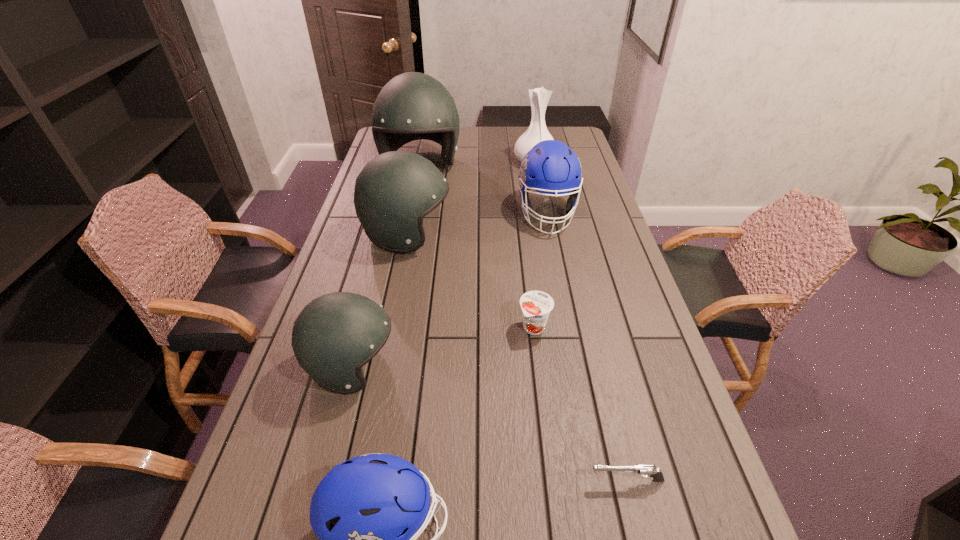
You are a GUI agent. You are given a task and a screenshot of the screen. Output one action in this format:
    pyautogui.click(x=<x>, y=<y>)
    Task: Click on the tallest object
    
    Given the screenshot: What is the action you would take?
    pyautogui.click(x=412, y=106)

Where is `the farthest football helmet`? the farthest football helmet is located at coordinates (412, 106).

Where is `white vase`? white vase is located at coordinates (539, 97).

Identify the location of the second nearest green football helmet. (394, 191).

Image resolution: width=960 pixels, height=540 pixels. I want to click on the right blue football helmet, so click(x=550, y=167).

Find the location of a particular element. This screenshot has width=960, height=540. the bigger blue football helmet is located at coordinates tap(550, 167).

Where is `the smallest green football helmet`? Image resolution: width=960 pixels, height=540 pixels. the smallest green football helmet is located at coordinates (335, 335).

At what (x,y) coordinates should I click in order to perform the action: click on the nearest green football helmet. Please return your answer as a coordinate pair (x, y). The image size is (960, 540). Looking at the image, I should click on (335, 335).

The image size is (960, 540). Identify the location of yogurt. (536, 305).

Locate an element on the screen. The image size is (960, 540). silver pistol is located at coordinates (645, 470).